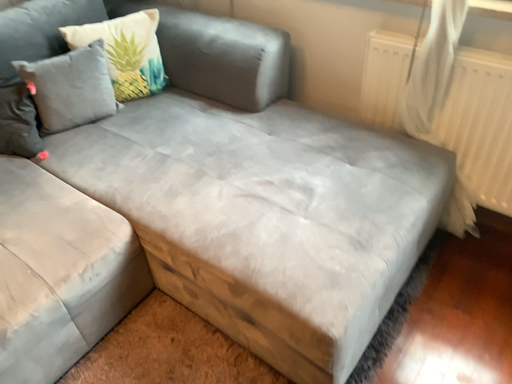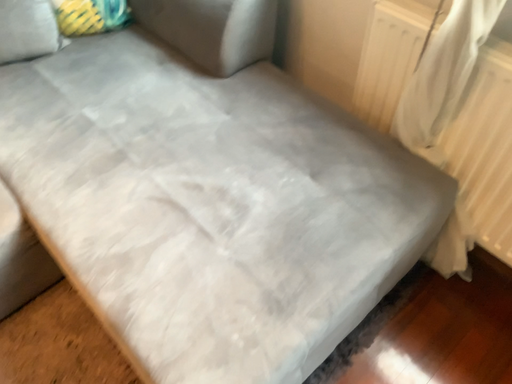
Question: Which way did the camera rotate in the video?

Choices:
 (A) rotated upward
 (B) rotated downward

Answer: (B)